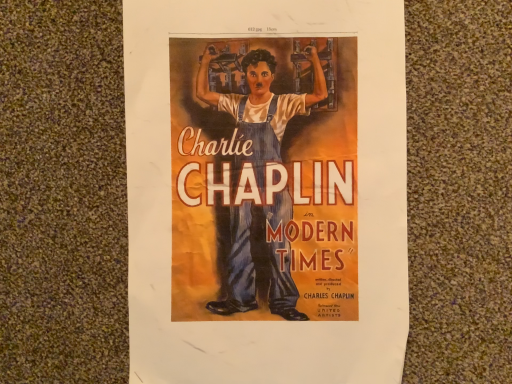
The height and width of the screenshot is (384, 512). Identify the location of vacant point above matte blue overalls at center (from a real-world perspective). (274, 184).